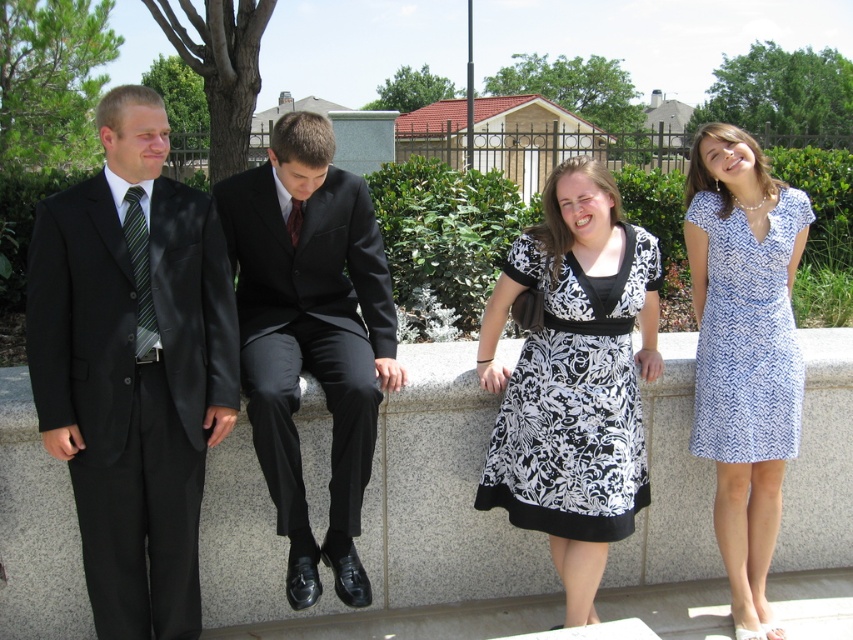
Question: Which object is farther from the camera taking this photo?

Choices:
 (A) blue zigzag-patterned dress at right
 (B) black silk tie at center

Answer: (A)

Question: Can you confirm if blue zigzag-patterned dress at right is positioned above black silk tie at center?

Choices:
 (A) no
 (B) yes

Answer: (A)

Question: Which point appears closest to the camera in this image?

Choices:
 (A) (279, 452)
 (B) (151, 294)
 (C) (245, 433)

Answer: (B)

Question: Among these objects, which one is nearest to the camera?

Choices:
 (A) granite ledge at center
 (B) black silk tie at center
 (C) black damask dress at center

Answer: (C)

Question: Can you confirm if granite ledge at center is positioned above black satin suit at center?

Choices:
 (A) no
 (B) yes

Answer: (A)

Question: Can you confirm if green striped tie at left is positioned below black silk tie at center?

Choices:
 (A) no
 (B) yes

Answer: (B)